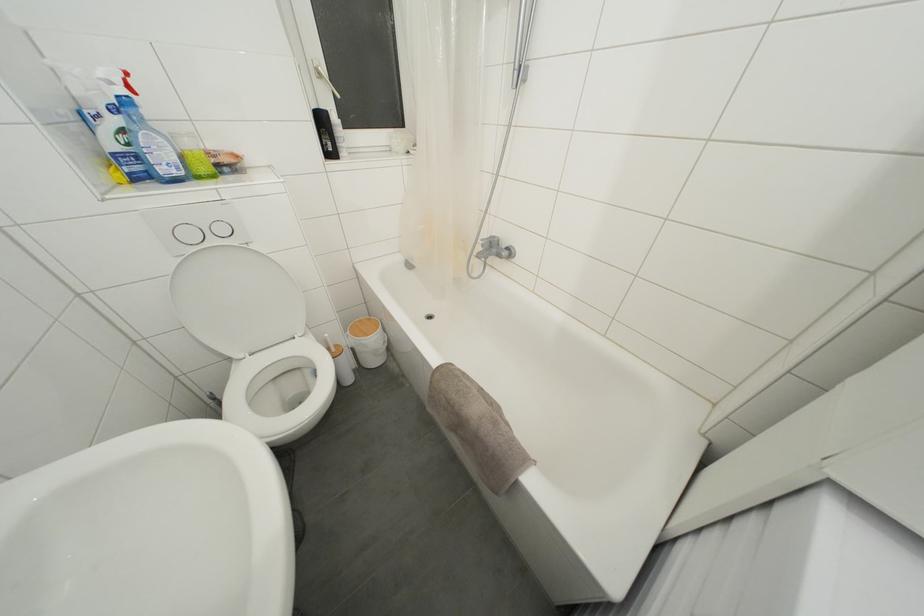
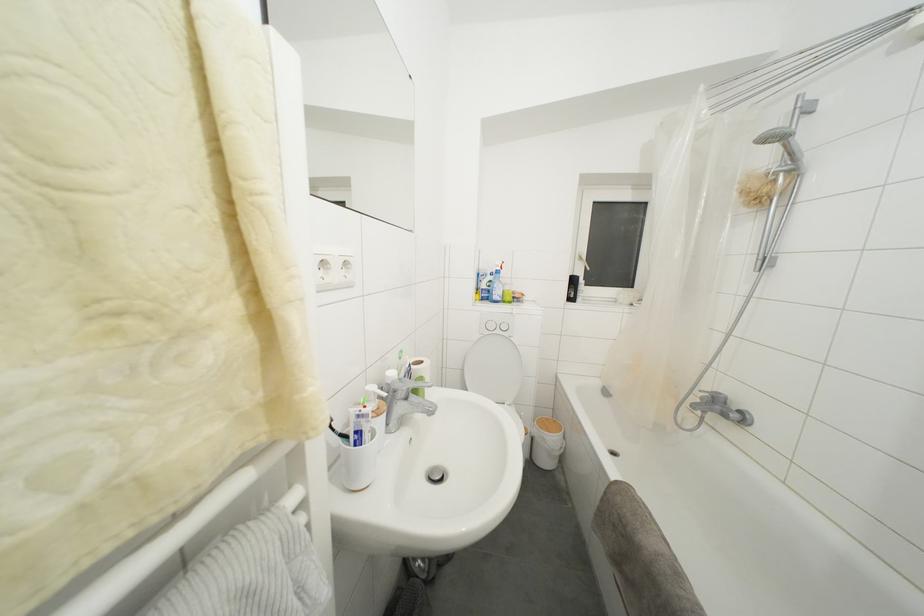
Where in the second image is the point corresponding to point (484, 241) from the first image?

(703, 392)